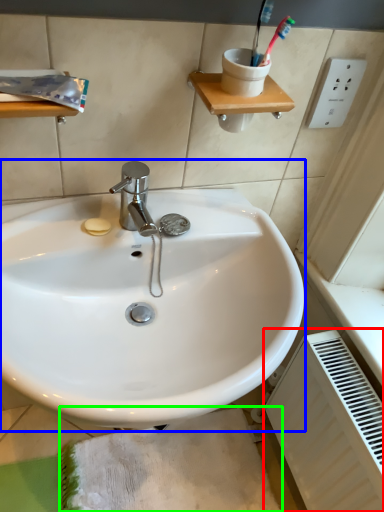
Question: Which is farther away from radiator (highlighted by a red box)? sink (highlighted by a blue box) or bath mat (highlighted by a green box)?

Choices:
 (A) sink
 (B) bath mat

Answer: (A)